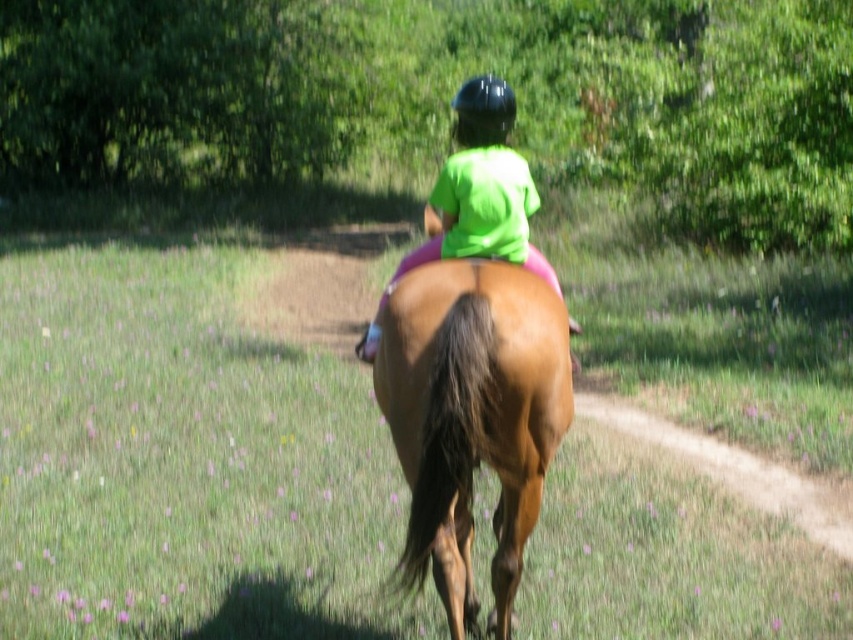
You are a photographer trying to capture the rider and horse in the scene. Since the green grassy field at center and the brown glossy horse at center are both in the frame, which one is positioned higher in the image?

The green grassy field at center is above the brown glossy horse at center, so the green grassy field at center is positioned higher in the image.